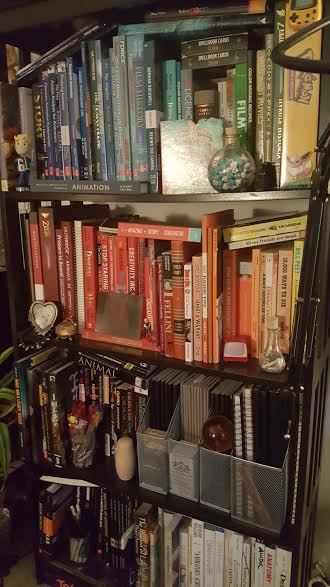
You are a GUI agent. You are given a task and a screenshot of the screen. Output one action in this format:
    pyautogui.click(x=<x>, y=<y>)
    Task: Click on the music box
    
    Given the screenshot: What is the action you would take?
    pyautogui.click(x=66, y=330)